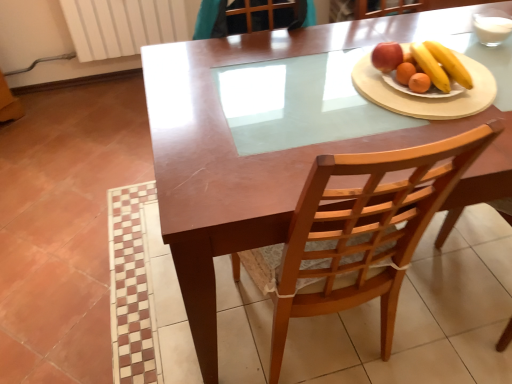
Find the location of a particular element. The height and width of the screenshot is (384, 512). free space above white ceramic plate at upper right (from a real-world perspective) is located at coordinates (420, 86).